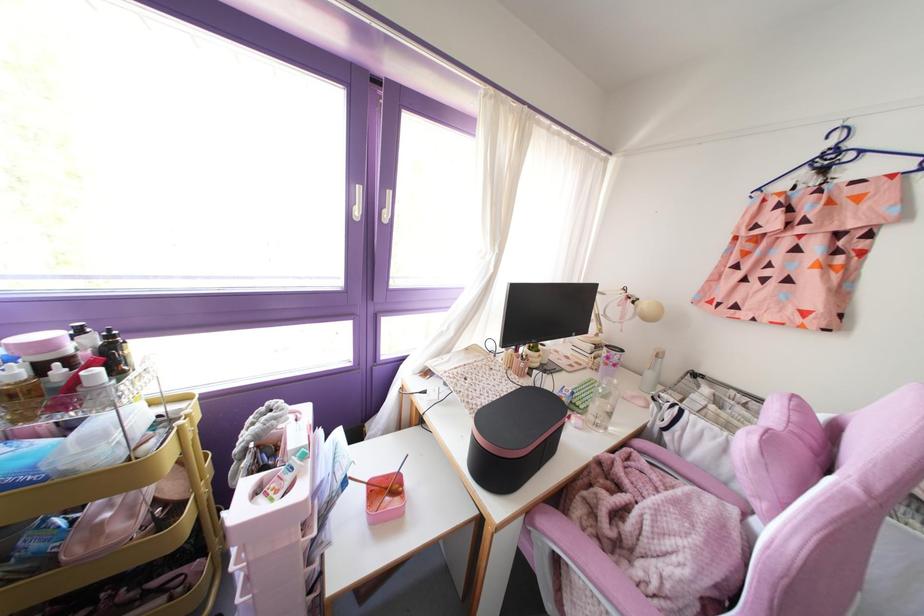
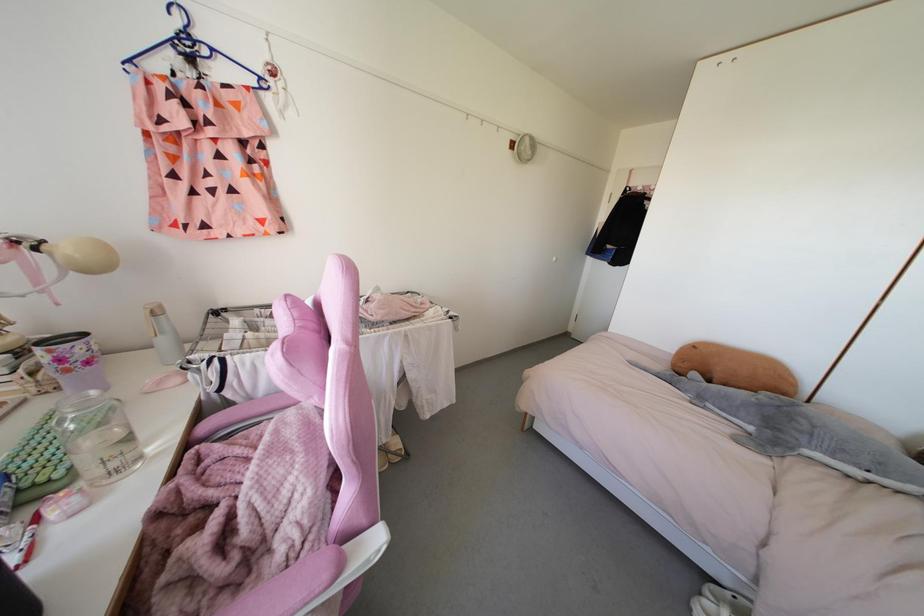
In the second image, find the point that corresponds to point 626,541 in the first image.

(252, 543)